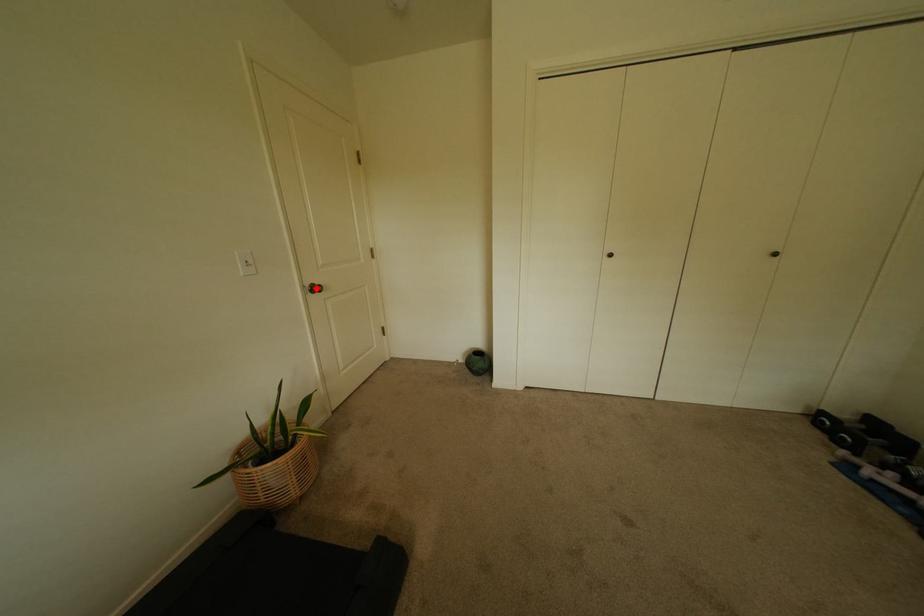
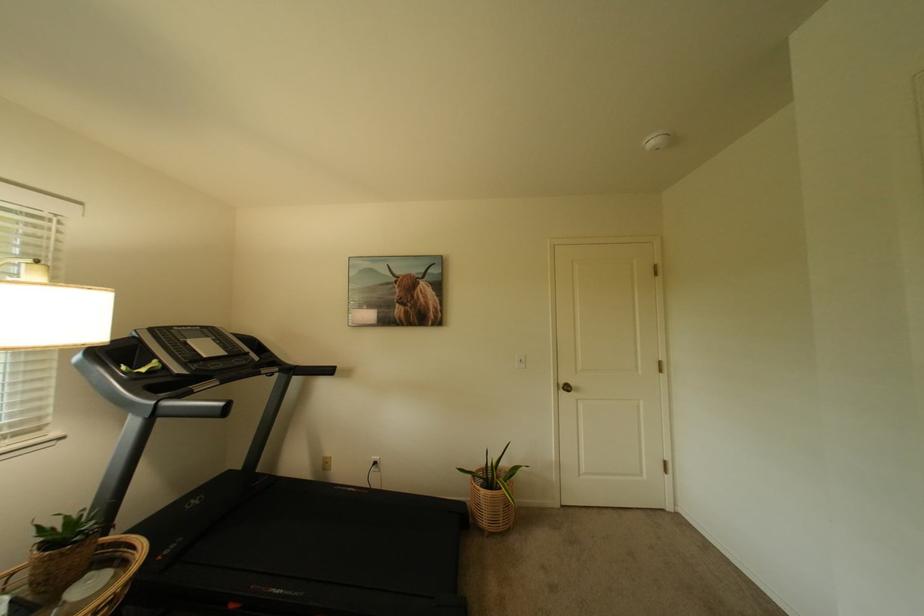
Question: A red point is marked in image1. In image2, is the corresponding 3D point closer to the camera or farther? Reply with the corresponding letter.

Choices:
 (A) The corresponding 3D point is closer.
 (B) The corresponding 3D point is farther.

Answer: (B)